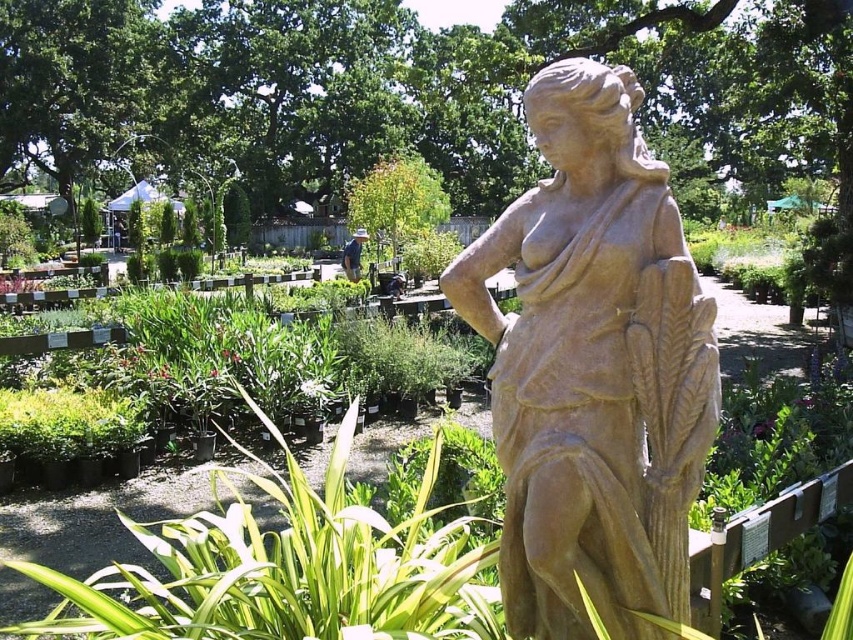
Does point (515, 577) come farther from viewer compared to point (163, 625)?

No, (515, 577) is closer to viewer.

Can you confirm if matte stone statue at center is thinner than green leafy plant at center?

Correct, matte stone statue at center's width is less than green leafy plant at center's.

You are a GUI agent. You are given a task and a screenshot of the screen. Output one action in this format:
    pyautogui.click(x=<x>, y=<y>)
    Task: Click on the matte stone statue at center
    Image resolution: width=853 pixels, height=640 pixels.
    Given the screenshot: What is the action you would take?
    pyautogui.click(x=593, y=369)